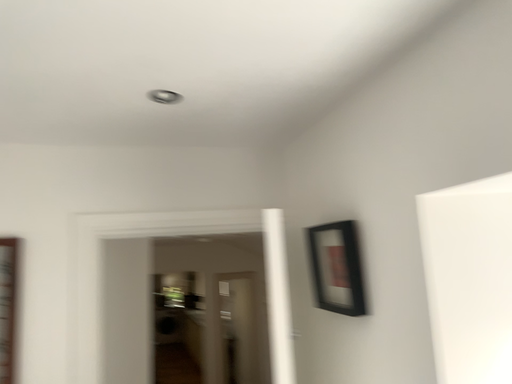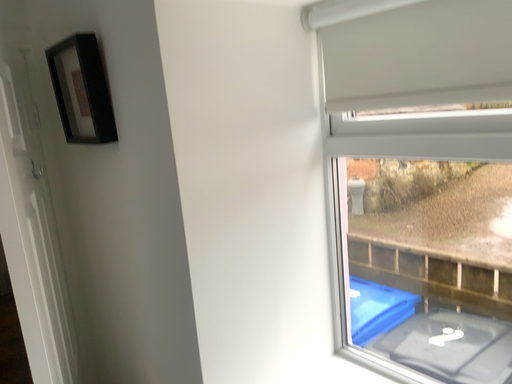
Question: Which way did the camera rotate in the video?

Choices:
 (A) rotated left
 (B) rotated right

Answer: (B)